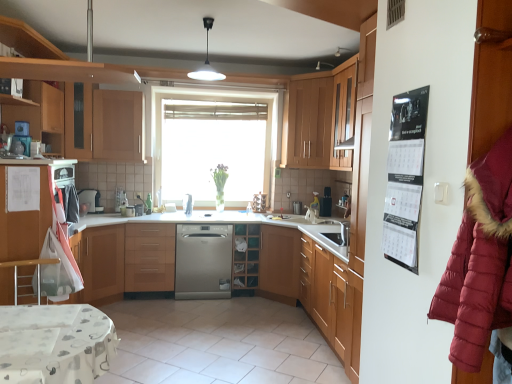
Question: In the image, is metallic silver bar stool at lower left on the left side or the right side of white glossy refrigerator at left, which is the fifth cabinetry from right to left?

Choices:
 (A) right
 (B) left

Answer: (A)

Question: From a real-world perspective, is metallic silver bar stool at lower left positioned above or below white glossy refrigerator at left, which is the fifth cabinetry from right to left?

Choices:
 (A) below
 (B) above

Answer: (A)

Question: Which is nearer to the black glossy calendar at right?

Choices:
 (A) black plastic toaster at center, arranged as the 2th appliance when viewed from the back
 (B) wooden cabinet at upper center, the fourth cabinetry in the right-to-left sequence
 (C) white glossy light fixture at upper center
 (D) satin silver dishwasher at center, the third appliance positioned from the right
 (E) wooden cabinet at center, positioned as the third cabinetry in left-to-right order

Answer: (C)

Question: Estimate the real-world distances between objects in this image. Which object is farther from the black glossy calendar at right?

Choices:
 (A) wooden cabinet at upper right, marked as the first cabinetry in a right-to-left arrangement
 (B) white glossy refrigerator at left, which is the fifth cabinetry from right to left
 (C) white plastic table at lower left
 (D) burgundy puffy coat at right
 (E) white glossy light fixture at upper center

Answer: (E)